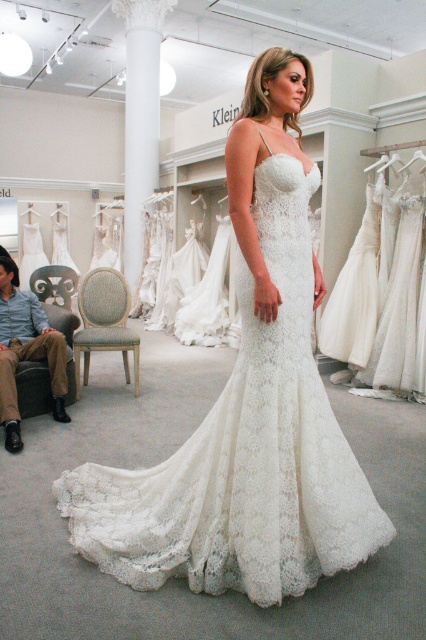
Question: Is white marble column at center positioned at the back of matte white dress at lower left?

Choices:
 (A) no
 (B) yes

Answer: (B)

Question: Can you confirm if white marble column at center is positioned above matte white dress at lower left?

Choices:
 (A) yes
 (B) no

Answer: (A)

Question: Observing the image, what is the correct spatial positioning of white marble column at center in reference to matte white dress at lower left?

Choices:
 (A) left
 (B) right

Answer: (B)

Question: Among these points, which one is nearest to the camera?

Choices:
 (A) (97, 486)
 (B) (31, 316)
 (C) (132, 4)

Answer: (A)

Question: Which point appears closest to the camera in this image?

Choices:
 (A) (85, 499)
 (B) (57, 371)
 (C) (137, 28)

Answer: (A)

Question: Which object is positioned closest to the white lace dress at center?

Choices:
 (A) matte white dress at lower left
 (B) white marble column at center

Answer: (A)